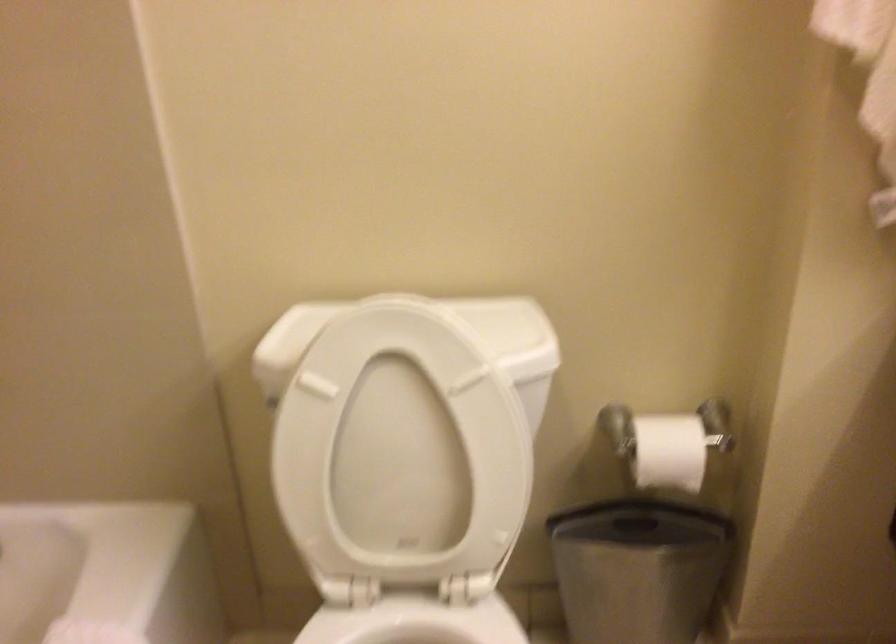
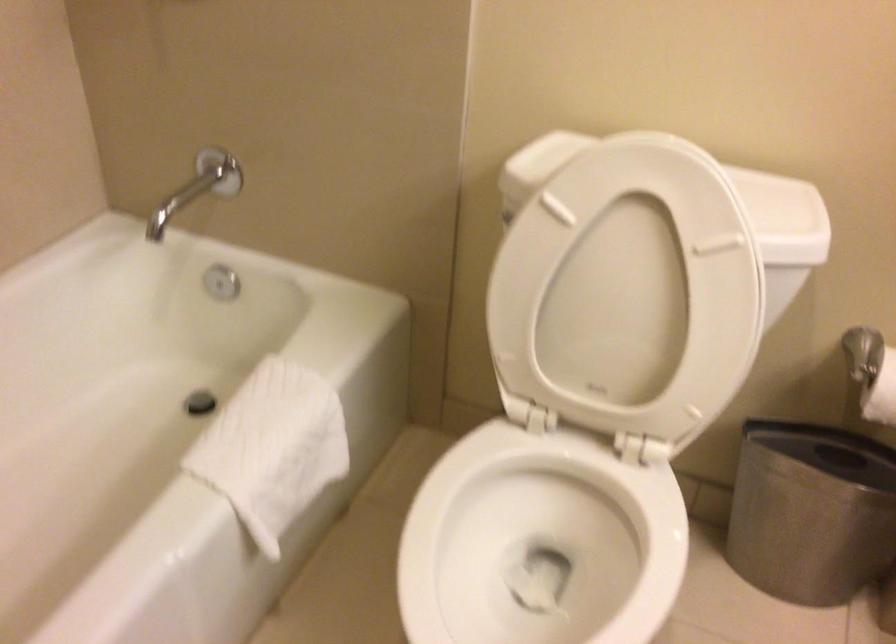
Question: The camera is either moving clockwise (left) or counter-clockwise (right) around the object. The first image is from the beginning of the video and the second image is from the end. Is the camera moving left or right when shooting the video?

Choices:
 (A) Left
 (B) Right

Answer: (B)